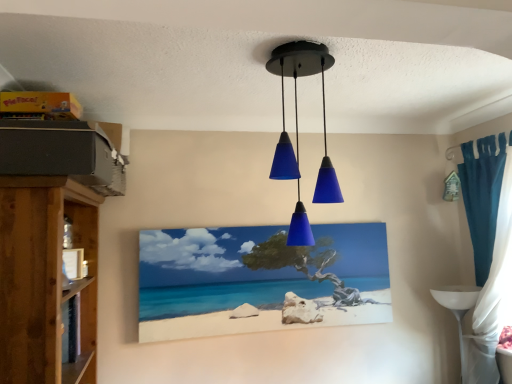
Where is `white matte picture frame at left, which is the 2th picture frame from back to front`? The width and height of the screenshot is (512, 384). white matte picture frame at left, which is the 2th picture frame from back to front is located at coordinates (73, 263).

How much space does matte canvas painting at center, marked as the 1th picture frame in a back-to-front arrangement, occupy horizontally?

1.98 inches.

Where is `matte blue glass pendant lights at center`? matte blue glass pendant lights at center is located at coordinates (296, 123).

Is white glossy table at lower right oriented towards teal fabric curtain at right?

Yes, white glossy table at lower right is oriented towards teal fabric curtain at right.

Who is bigger, white glossy table at lower right or teal fabric curtain at right?

teal fabric curtain at right.

From a real-world perspective, which object stands above the other?

teal fabric curtain at right is physically above.

Can we say white glossy table at lower right lies outside teal fabric curtain at right?

That's incorrect, white glossy table at lower right is not completely outside teal fabric curtain at right.

Measure the distance between white matte picture frame at left, which is the 2th picture frame from right to left, and white glossy table at lower right.

A distance of 2.03 meters exists between white matte picture frame at left, which is the 2th picture frame from right to left, and white glossy table at lower right.

Is white matte picture frame at left, which is the 2th picture frame from right to left, wider than white glossy table at lower right?

No.

Is white matte picture frame at left, which is the 2th picture frame from right to left, to the left or to the right of white glossy table at lower right in the image?

In the image, white matte picture frame at left, which is the 2th picture frame from right to left, appears on the left side of white glossy table at lower right.

Is white matte picture frame at left, which is the 2th picture frame from back to front, closer to camera compared to white glossy table at lower right?

Yes, it is in front of white glossy table at lower right.

Which of these two, teal fabric curtain at right or white matte picture frame at left, which is the 2th picture frame from back to front, is bigger?

teal fabric curtain at right is bigger.

Could you tell me if teal fabric curtain at right is turned towards white matte picture frame at left, the 1th picture frame in the front-to-back sequence?

Yes, teal fabric curtain at right is oriented towards white matte picture frame at left, the 1th picture frame in the front-to-back sequence.

Is teal fabric curtain at right far from white matte picture frame at left, which is the 2th picture frame from right to left?

Absolutely, teal fabric curtain at right is distant from white matte picture frame at left, which is the 2th picture frame from right to left.

Is teal fabric curtain at right to the right of wooden shelf at left from the viewer's perspective?

Yes.

Is teal fabric curtain at right bigger than wooden shelf at left?

No.

Which of these two, teal fabric curtain at right or wooden shelf at left, is wider?

wooden shelf at left.

Can you confirm if wooden shelf at left is positioned to the left of teal fabric curtain at right?

Correct, you'll find wooden shelf at left to the left of teal fabric curtain at right.

From the image's perspective, is wooden shelf at left under teal fabric curtain at right?

Yes.

Which is correct: wooden shelf at left is inside teal fabric curtain at right, or outside of it?

wooden shelf at left is outside teal fabric curtain at right.

Which is closer to the camera, (57, 191) or (471, 216)?

Point (57, 191).

From the image's perspective, which is above, matte canvas painting at center, positioned as the 2th picture frame in front-to-back order, or teal fabric curtain at right?

teal fabric curtain at right, from the image's perspective.

How different are the orientations of matte canvas painting at center, arranged as the 2th picture frame when viewed from the left, and teal fabric curtain at right in degrees?

The angle between the facing direction of matte canvas painting at center, arranged as the 2th picture frame when viewed from the left, and the facing direction of teal fabric curtain at right is 89.7 degrees.

Which is more to the left, matte canvas painting at center, arranged as the 2th picture frame when viewed from the left, or teal fabric curtain at right?

matte canvas painting at center, arranged as the 2th picture frame when viewed from the left, is more to the left.

How many degrees apart are the facing directions of teal fabric curtain at right and matte canvas painting at center, positioned as the 2th picture frame in front-to-back order?

The angle between the facing direction of teal fabric curtain at right and the facing direction of matte canvas painting at center, positioned as the 2th picture frame in front-to-back order, is 89.7 degrees.

Is teal fabric curtain at right in front of or behind matte canvas painting at center, positioned as the 2th picture frame in front-to-back order, in the image?

Visually, teal fabric curtain at right is located in front of matte canvas painting at center, positioned as the 2th picture frame in front-to-back order.

From the image's perspective, is teal fabric curtain at right beneath matte canvas painting at center, positioned as the 2th picture frame in front-to-back order?

No, from the image's perspective, teal fabric curtain at right is not below matte canvas painting at center, positioned as the 2th picture frame in front-to-back order.

Measure the distance between teal fabric curtain at right and matte canvas painting at center, arranged as the 2th picture frame when viewed from the left.

teal fabric curtain at right and matte canvas painting at center, arranged as the 2th picture frame when viewed from the left, are 37.78 inches apart from each other.

Identify the location of table directly beneath the teal fabric curtain at right (from a real-world perspective). (458, 310).

The width and height of the screenshot is (512, 384). I want to click on table located below the white matte picture frame at left, which is the 2th picture frame from right to left (from the image's perspective), so click(x=458, y=310).

Based on their spatial positions, is matte canvas painting at center, marked as the 1th picture frame in a back-to-front arrangement, or matte blue glass pendant lights at center closer to white matte picture frame at left, the first picture frame in the left-to-right sequence?

The object closer to white matte picture frame at left, the first picture frame in the left-to-right sequence, is matte canvas painting at center, marked as the 1th picture frame in a back-to-front arrangement.

Which object lies further to the anchor point teal fabric curtain at right, wooden shelf at left or white matte picture frame at left, the 1th picture frame in the front-to-back sequence?

white matte picture frame at left, the 1th picture frame in the front-to-back sequence, is positioned further to the anchor teal fabric curtain at right.

From the image, which object appears to be farther from teal fabric curtain at right, white glossy table at lower right or matte blue glass pendant lights at center?

matte blue glass pendant lights at center is positioned further to the anchor teal fabric curtain at right.

Based on their spatial positions, is white glossy table at lower right or matte blue glass pendant lights at center further from matte canvas painting at center, which appears as the 1th picture frame when viewed from the right?

Among the two, white glossy table at lower right is located further to matte canvas painting at center, which appears as the 1th picture frame when viewed from the right.

When comparing their distances from matte blue glass pendant lights at center, does matte canvas painting at center, positioned as the 2th picture frame in front-to-back order, or white matte picture frame at left, which is the 2th picture frame from right to left, seem closer?

The object closer to matte blue glass pendant lights at center is matte canvas painting at center, positioned as the 2th picture frame in front-to-back order.

Estimate the real-world distances between objects in this image. Which object is closer to matte canvas painting at center, marked as the 1th picture frame in a back-to-front arrangement, white matte picture frame at left, which is the 2th picture frame from right to left, or wooden shelf at left?

→ Based on the image, white matte picture frame at left, which is the 2th picture frame from right to left, appears to be nearer to matte canvas painting at center, marked as the 1th picture frame in a back-to-front arrangement.

From the image, which object appears to be nearer to matte blue glass pendant lights at center, teal fabric curtain at right or matte canvas painting at center, which appears as the 1th picture frame when viewed from the right?

matte canvas painting at center, which appears as the 1th picture frame when viewed from the right, is positioned closer to the anchor matte blue glass pendant lights at center.

From the image, which object appears to be nearer to white glossy table at lower right, white matte picture frame at left, which is the 2th picture frame from right to left, or teal fabric curtain at right?

teal fabric curtain at right lies closer to white glossy table at lower right than the other object.

Where is `picture frame between white matte picture frame at left, which is the 2th picture frame from right to left, and white glossy table at lower right from left to right`? This screenshot has height=384, width=512. picture frame between white matte picture frame at left, which is the 2th picture frame from right to left, and white glossy table at lower right from left to right is located at coordinates (259, 278).

Find the location of a particular element. The image size is (512, 384). picture frame located between white matte picture frame at left, the first picture frame in the left-to-right sequence, and matte blue glass pendant lights at center in the left-right direction is located at coordinates (259, 278).

Identify the location of picture frame situated between wooden shelf at left and matte blue glass pendant lights at center from left to right. (259, 278).

Locate an element on the screen. Image resolution: width=512 pixels, height=384 pixels. lamp between wooden shelf at left and white glossy table at lower right is located at coordinates (296, 123).